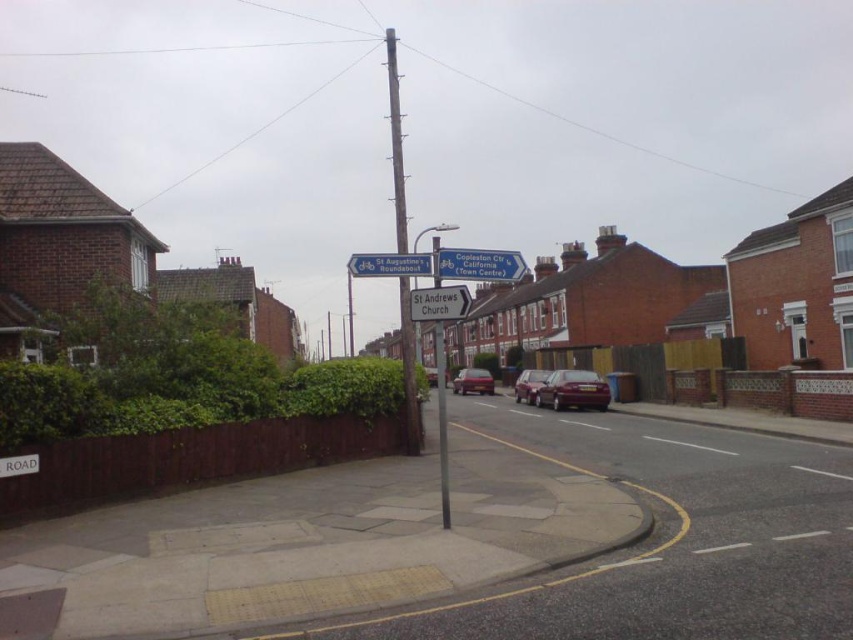
Who is shorter, smooth gray pole at center or metallic pole at center?

metallic pole at center

Is smooth gray pole at center above metallic pole at center?

Indeed, smooth gray pole at center is positioned over metallic pole at center.

Measure the distance between smooth gray pole at center and camera.

smooth gray pole at center is 36.32 feet away from camera.

The height and width of the screenshot is (640, 853). What are the coordinates of `smooth gray pole at center` in the screenshot? It's located at (396, 141).

Does white plastic street sign at upper center come in front of metallic pole at center?

Yes, it is in front of metallic pole at center.

Can you confirm if white plastic street sign at upper center is taller than metallic pole at center?

No, white plastic street sign at upper center is not taller than metallic pole at center.

Is point (456, 260) behind point (454, 227)?

That is False.

The height and width of the screenshot is (640, 853). I want to click on white plastic street sign at upper center, so [479, 264].

Which is above, metallic pole at center or metallic silver car at center?

Positioned higher is metallic pole at center.

This screenshot has height=640, width=853. What do you see at coordinates (440, 420) in the screenshot?
I see `metallic pole at center` at bounding box center [440, 420].

Identify the location of metallic pole at center. This screenshot has height=640, width=853. (440, 420).